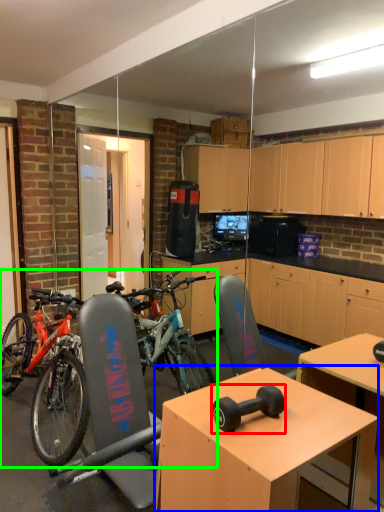
Question: Considering the real-world distances, which object is farthest from dumbbell (highlighted by a red box)? desk (highlighted by a blue box) or bicycle (highlighted by a green box)?

Choices:
 (A) desk
 (B) bicycle

Answer: (B)